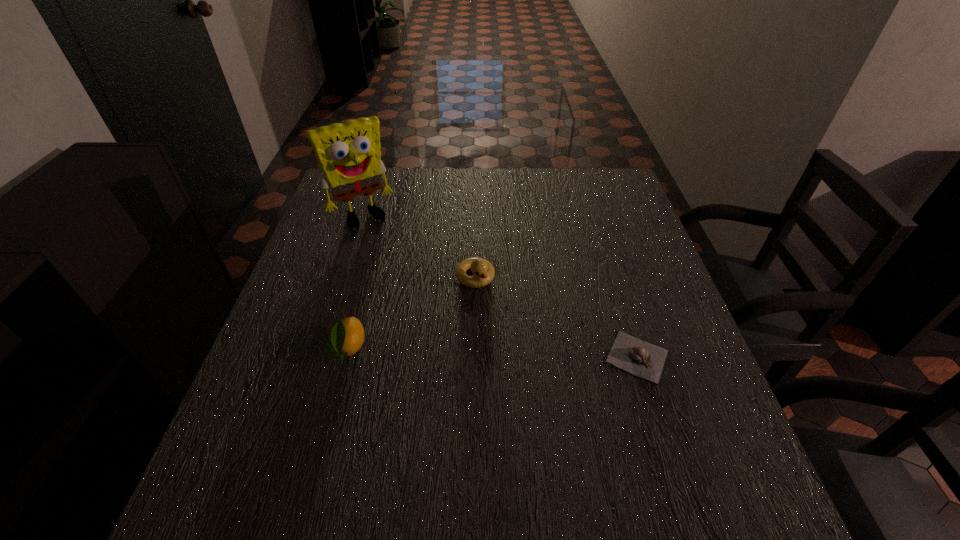
At what (x,y) coordinates should I click in order to perform the action: click on free space that is in between the lemon and the third nearest object. Please return your answer as a coordinate pair (x, y). The image size is (960, 540). Looking at the image, I should click on (412, 313).

The image size is (960, 540). I want to click on free space that is in between the lemon and the shortest object, so click(x=492, y=353).

In order to click on free point between the shortest object and the tallest object in this screenshot , I will do `click(500, 286)`.

In order to click on free space between the shortest object and the lemon in this screenshot , I will do `click(492, 353)`.

Image resolution: width=960 pixels, height=540 pixels. I want to click on the third closest object to the rightmost object, so [x=349, y=155].

Select which object appears as the second closest to the tallest object. Please provide its 2D coordinates. Your answer should be formatted as a tuple, i.e. [(x, y)], where the tuple contains the x and y coordinates of a point satisfying the conditions above.

[(347, 336)]

Image resolution: width=960 pixels, height=540 pixels. Find the location of `free location that satisfies the following two spatial constraints: 1. with leaves positioned above the rightmost object; 2. on the right side of the lemon`. free location that satisfies the following two spatial constraints: 1. with leaves positioned above the rightmost object; 2. on the right side of the lemon is located at coordinates (346, 356).

Find the location of a particular element. The width and height of the screenshot is (960, 540). vacant point that satisfies the following two spatial constraints: 1. with leaves positioned above the lemon; 2. on the right side of the shortest object is located at coordinates (346, 356).

At what (x,y) coordinates should I click in order to perform the action: click on vacant region that satisfies the following two spatial constraints: 1. on the front side of the shortest object; 2. on the right side of the second farthest object. Please return your answer as a coordinate pair (x, y). Image resolution: width=960 pixels, height=540 pixels. Looking at the image, I should click on (474, 356).

Locate an element on the screen. The height and width of the screenshot is (540, 960). vacant region that satisfies the following two spatial constraints: 1. with leaves positioned above the lemon; 2. on the right side of the garlic is located at coordinates (346, 356).